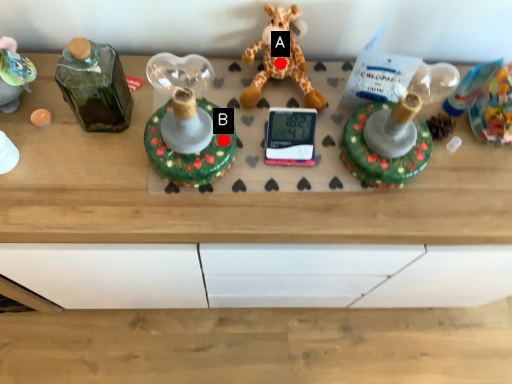
Question: Two points are circled on the image, labeled by A and B beside each circle. Which point appears closest to the camera in this image?

Choices:
 (A) A is closer
 (B) B is closer

Answer: (B)